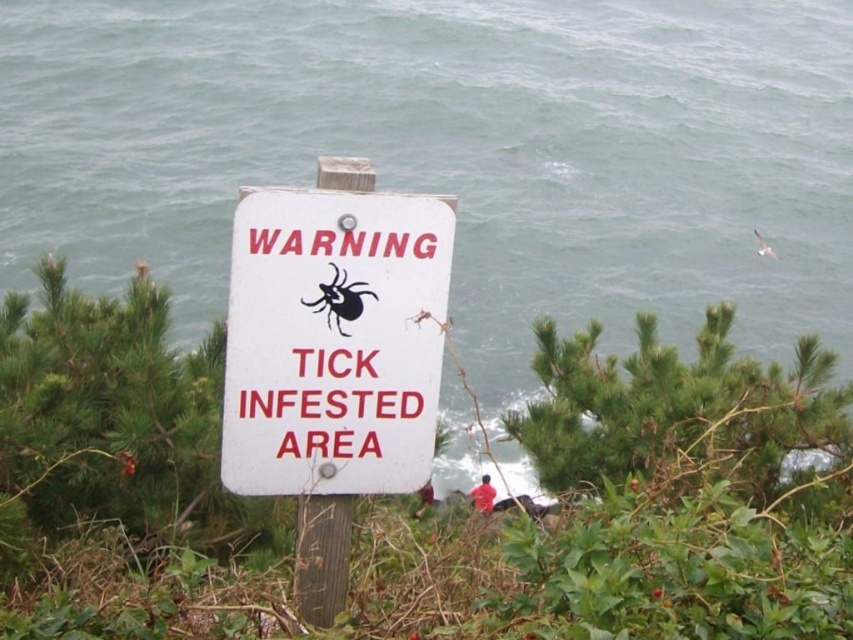
You are standing in front of the warning sign on the wooden post. There are two points marked on the sign, one at coordinates point (403, 317) and the other at point (355, 314). Which point is closer to you?

Point (355, 314) is closer to you because it is less further to the camera than point (403, 317).